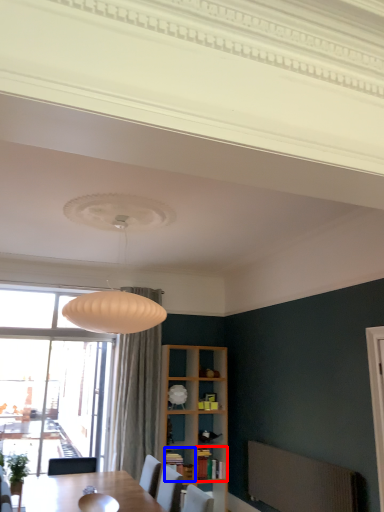
Question: Among these objects, which one is nearest to the camera, cabinet (highlighted by a red box) or shelf (highlighted by a blue box)?

Choices:
 (A) cabinet
 (B) shelf

Answer: (B)